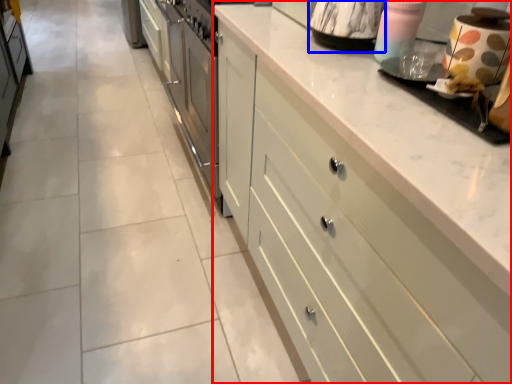
Question: Which point is closer to the camera, cabinetry (highlighted by a red box) or appliance (highlighted by a blue box)?

Choices:
 (A) cabinetry
 (B) appliance

Answer: (A)